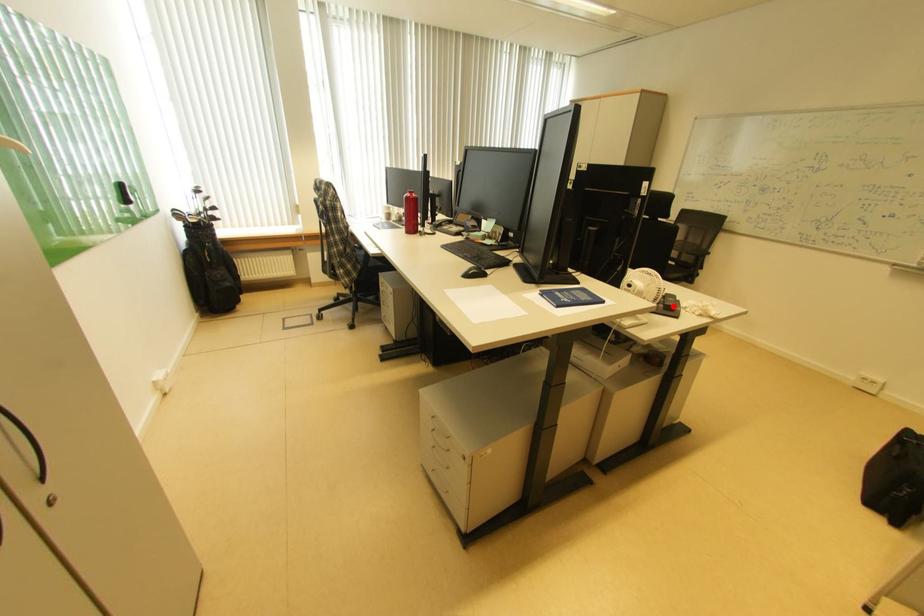
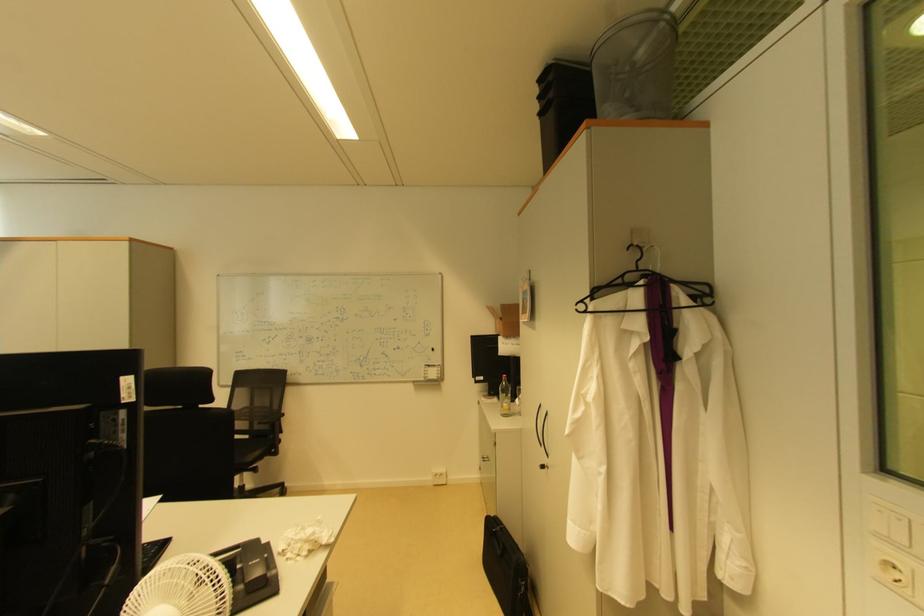
In the second image, find the point that corresponds to the highlighted location in the first image.

(254, 586)